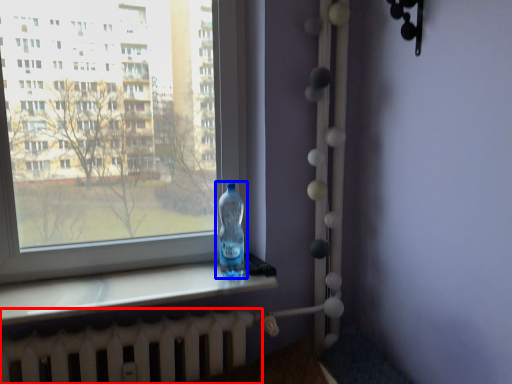
Question: Which object appears closest to the camera in this image, radiator (highlighted by a red box) or bottle (highlighted by a blue box)?

Choices:
 (A) radiator
 (B) bottle

Answer: (A)